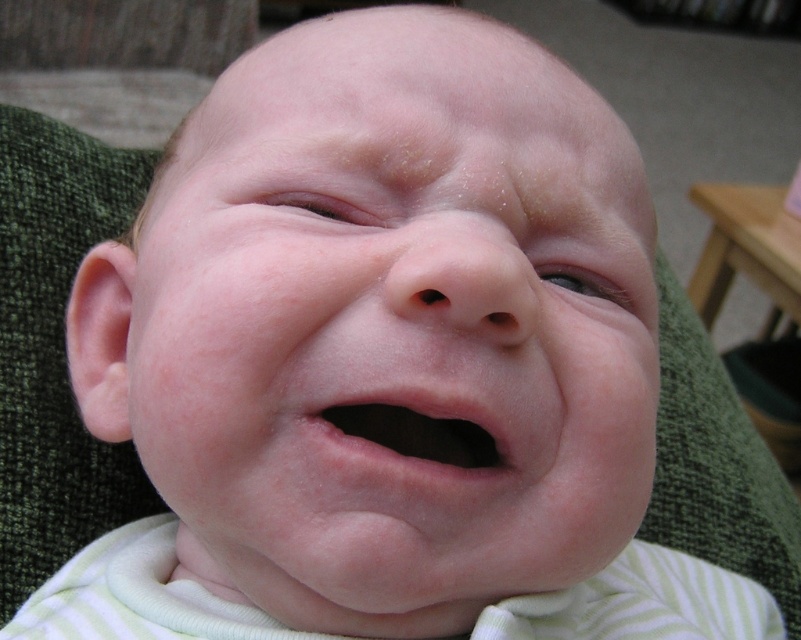
You are a pediatrician examining a baby. You notice the smooth skin face at center and the pink smooth lips at center. Which of these is closer to your view?

The smooth skin face at center is closer to your view than the pink smooth lips at center because the smooth skin face at center is in front of the pink smooth lips at center.